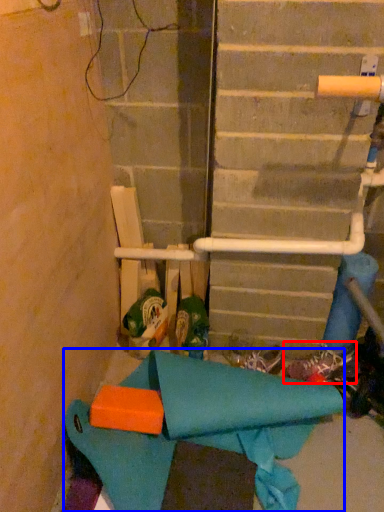
Question: Which object is further to the camera taking this photo, footwear (highlighted by a red box) or fabric (highlighted by a blue box)?

Choices:
 (A) footwear
 (B) fabric

Answer: (A)